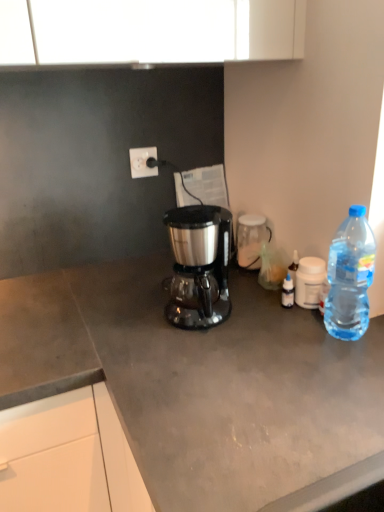
The height and width of the screenshot is (512, 384). Identify the location of vacant location behind satin black coffee maker at center. (168, 286).